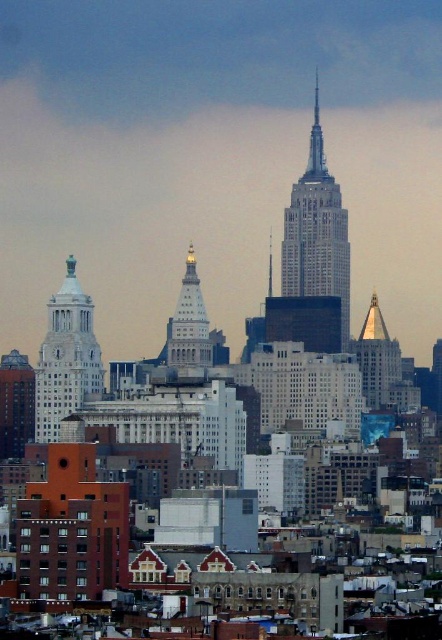
Question: Which point is closer to the camera taking this photo?

Choices:
 (A) (194, 288)
 (B) (309, 164)
 (C) (77, 330)
 (D) (372, 349)

Answer: (A)

Question: Can you confirm if white stone tower at center is positioned below white marble tower at center?

Choices:
 (A) no
 (B) yes

Answer: (A)

Question: Is gold reflective spire at center above white marble tower at center?

Choices:
 (A) no
 (B) yes

Answer: (A)

Question: Does white stone tower at center appear on the left side of white marble tower at upper left?

Choices:
 (A) no
 (B) yes

Answer: (A)

Question: Which point is farther to the camera?

Choices:
 (A) white marble tower at upper left
 (B) gold reflective spire at center
 (C) white stone tower at center

Answer: (B)

Question: Which object is positioned closest to the white marble tower at center?

Choices:
 (A) white marble tower at upper left
 (B) white stone tower at center
 (C) gold reflective spire at center

Answer: (A)